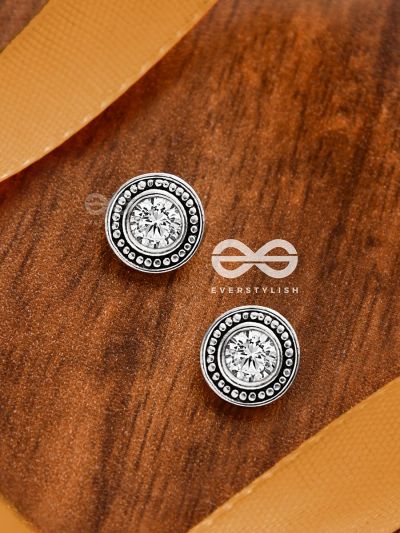
Find the location of `table`. table is located at coordinates (163, 326).